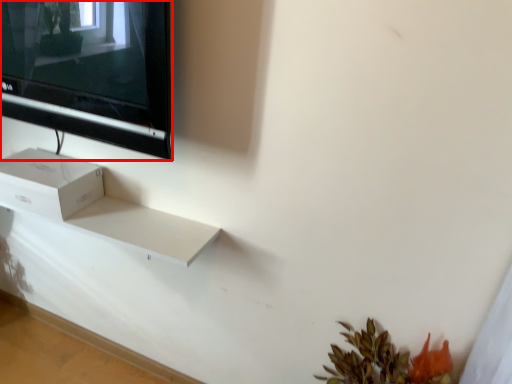
Question: In this image, where is television (annotated by the red box) located relative to box?

Choices:
 (A) left
 (B) right

Answer: (B)